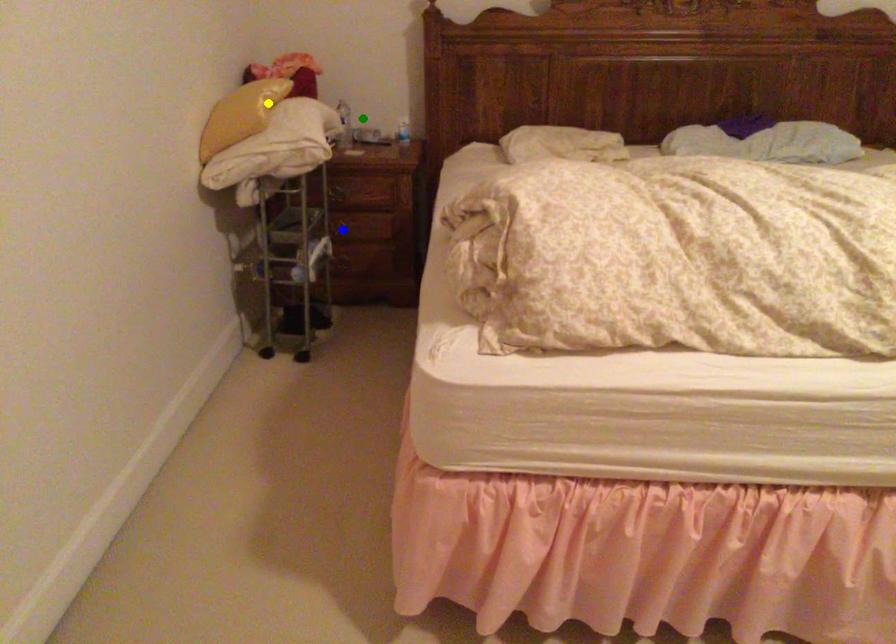
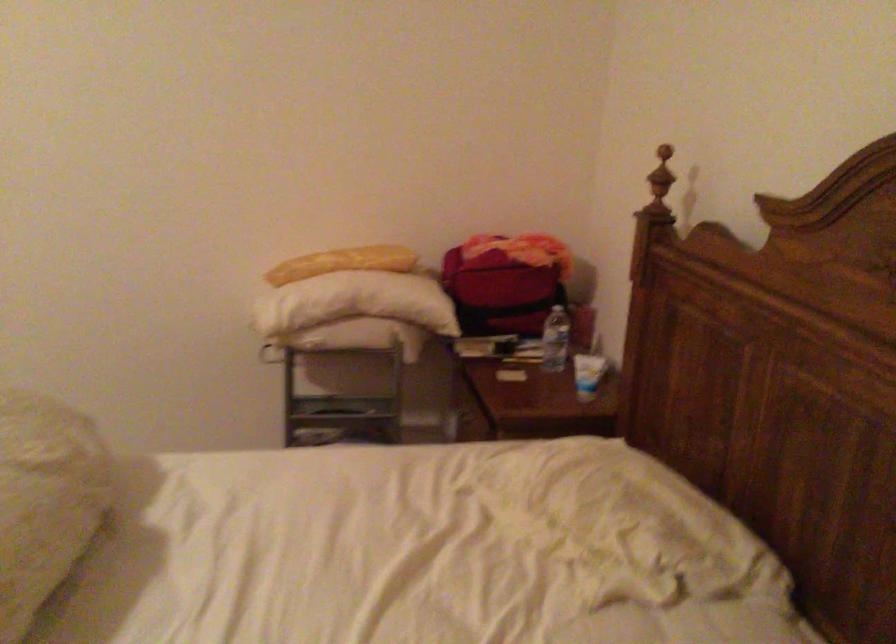
I am providing you with two images of the same scene from different viewpoints. Three points are marked in image1. Which point corresponds to a part or object that is occluded in image2?In image1, three points are marked. Which of them correspond to a part or object that is occluded in image2?Among the three points shown in image1, which one corresponds to a part or object that is no longer visible due to occlusion in image2?

blue point